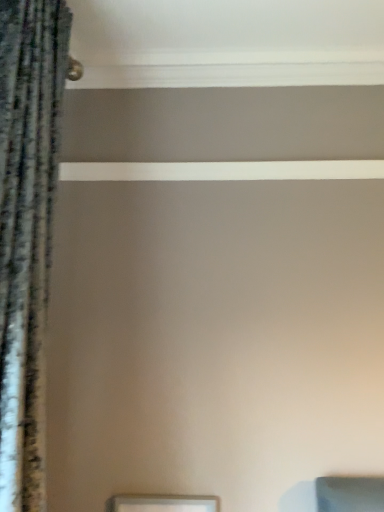
What do you see at coordinates (27, 230) in the screenshot?
I see `velvet-like dark gray curtain at left` at bounding box center [27, 230].

Where is `velvet-like dark gray curtain at left`? The image size is (384, 512). velvet-like dark gray curtain at left is located at coordinates (27, 230).

Where is `matte silver picture frame at lower center`? The image size is (384, 512). matte silver picture frame at lower center is located at coordinates (162, 503).

What do you see at coordinates (162, 503) in the screenshot? I see `matte silver picture frame at lower center` at bounding box center [162, 503].

Measure the distance between matte silver picture frame at lower center and camera.

1.36 meters.

Locate an element on the screen. The image size is (384, 512). velvet-like dark gray curtain at left is located at coordinates (27, 230).

Is velvet-like dark gray curtain at left to the right of matte silver picture frame at lower center from the viewer's perspective?

No, velvet-like dark gray curtain at left is not to the right of matte silver picture frame at lower center.

Is velvet-like dark gray curtain at left positioned in front of matte silver picture frame at lower center?

That is True.

Which is in front, point (19, 207) or point (195, 499)?

The point (19, 207) is closer to the camera.

From the image's perspective, relative to matte silver picture frame at lower center, is velvet-like dark gray curtain at left above or below?

velvet-like dark gray curtain at left is above matte silver picture frame at lower center.

From a real-world perspective, which is physically below, velvet-like dark gray curtain at left or matte silver picture frame at lower center?

matte silver picture frame at lower center is physically lower.

Considering the relative sizes of velvet-like dark gray curtain at left and matte silver picture frame at lower center in the image provided, is velvet-like dark gray curtain at left wider than matte silver picture frame at lower center?

Indeed, velvet-like dark gray curtain at left has a greater width compared to matte silver picture frame at lower center.

Considering the relative sizes of velvet-like dark gray curtain at left and matte silver picture frame at lower center in the image provided, is velvet-like dark gray curtain at left shorter than matte silver picture frame at lower center?

No, velvet-like dark gray curtain at left is not shorter than matte silver picture frame at lower center.

Which of these two, velvet-like dark gray curtain at left or matte silver picture frame at lower center, is smaller?

matte silver picture frame at lower center is smaller.

Can matte silver picture frame at lower center be found inside velvet-like dark gray curtain at left?

Actually, matte silver picture frame at lower center is outside velvet-like dark gray curtain at left.

Is velvet-like dark gray curtain at left beside matte silver picture frame at lower center?

No, velvet-like dark gray curtain at left is not touching matte silver picture frame at lower center.

Could you tell me if velvet-like dark gray curtain at left is facing matte silver picture frame at lower center?

No, velvet-like dark gray curtain at left is not facing towards matte silver picture frame at lower center.

How many degrees apart are the facing directions of velvet-like dark gray curtain at left and matte silver picture frame at lower center?

The angle between the facing direction of velvet-like dark gray curtain at left and the facing direction of matte silver picture frame at lower center is 90 degrees.

Find the location of `picture frame on the right of velvet-like dark gray curtain at left`. picture frame on the right of velvet-like dark gray curtain at left is located at coordinates (162, 503).

Which is more to the right, matte silver picture frame at lower center or velvet-like dark gray curtain at left?

Positioned to the right is matte silver picture frame at lower center.

Which object is closer to the camera, matte silver picture frame at lower center or velvet-like dark gray curtain at left?

velvet-like dark gray curtain at left is closer to the camera.

Is point (182, 510) closer or farther from the camera than point (43, 49)?

Point (182, 510) appears to be farther away from the viewer than point (43, 49).

From the image's perspective, which one is positioned lower, matte silver picture frame at lower center or velvet-like dark gray curtain at left?

matte silver picture frame at lower center is shown below in the image.

From a real-world perspective, is matte silver picture frame at lower center above or below velvet-like dark gray curtain at left?

matte silver picture frame at lower center is below velvet-like dark gray curtain at left.

Is matte silver picture frame at lower center wider than velvet-like dark gray curtain at left?

No.

Considering the sizes of objects matte silver picture frame at lower center and velvet-like dark gray curtain at left in the image provided, who is taller, matte silver picture frame at lower center or velvet-like dark gray curtain at left?

Standing taller between the two is velvet-like dark gray curtain at left.

Which of these two, matte silver picture frame at lower center or velvet-like dark gray curtain at left, is smaller?

matte silver picture frame at lower center is smaller.

Do you think matte silver picture frame at lower center is within velvet-like dark gray curtain at left, or outside of it?

matte silver picture frame at lower center cannot be found inside velvet-like dark gray curtain at left.

From the picture: Is matte silver picture frame at lower center far away from velvet-like dark gray curtain at left?

matte silver picture frame at lower center is near velvet-like dark gray curtain at left, not far away.

Is matte silver picture frame at lower center oriented away from velvet-like dark gray curtain at left?

No, matte silver picture frame at lower center is not facing away from velvet-like dark gray curtain at left.

Can you tell me how much matte silver picture frame at lower center and velvet-like dark gray curtain at left differ in facing direction?

There is a 90-degree angle between the facing directions of matte silver picture frame at lower center and velvet-like dark gray curtain at left.

Find the location of a particular element. curtain on the left of the matte silver picture frame at lower center is located at coordinates (27, 230).

Find the location of a particular element. This screenshot has width=384, height=512. curtain on the left of the matte silver picture frame at lower center is located at coordinates (27, 230).

Locate an element on the screen. The height and width of the screenshot is (512, 384). picture frame on the right of velvet-like dark gray curtain at left is located at coordinates (162, 503).